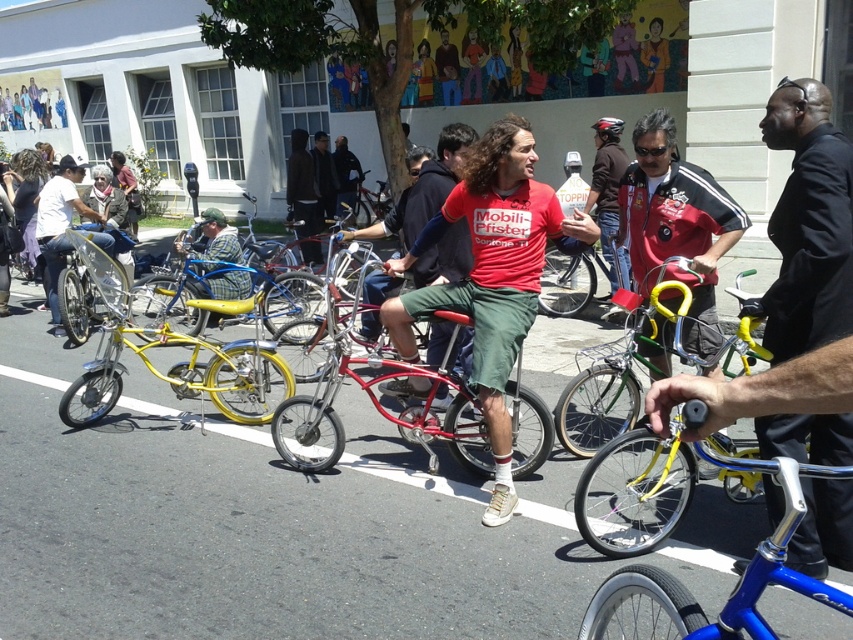
Identify the location of black suit jacket at center. The height and width of the screenshot is (640, 853). (808, 224).

Describe the element at coordinates (808, 224) in the screenshot. I see `black suit jacket at center` at that location.

Does point (804, 481) come farther from viewer compared to point (416, 440)?

No.

I want to click on black suit jacket at center, so click(808, 224).

Is blue metallic bicycle at center thinner than matte yellow bicycle at left?

Indeed, blue metallic bicycle at center has a lesser width compared to matte yellow bicycle at left.

Between point (735, 596) and point (42, 204), which one is positioned in front?

Point (735, 596) is more forward.

Which is in front, point (654, 586) or point (51, 237)?

Point (654, 586)

Find the location of a particular element. The height and width of the screenshot is (640, 853). blue metallic bicycle at center is located at coordinates (674, 528).

What do you see at coordinates (674, 528) in the screenshot? I see `blue metallic bicycle at center` at bounding box center [674, 528].

Is point (726, 628) closer to viewer compared to point (614, 282)?

That is True.

This screenshot has height=640, width=853. Find the location of `blue metallic bicycle at center`. blue metallic bicycle at center is located at coordinates (674, 528).